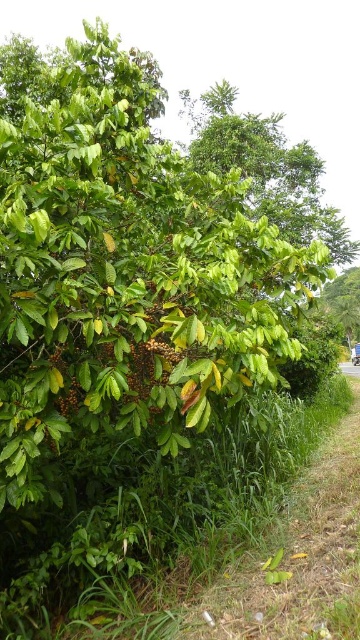
Which is more to the right, green leafy tree at upper center or green leafy tree at upper right?

From the viewer's perspective, green leafy tree at upper right appears more on the right side.

Is green leafy tree at upper center above green leafy tree at upper right?

Yes.

Who is more distant from viewer, (221, 131) or (333, 316)?

Positioned behind is point (333, 316).

Image resolution: width=360 pixels, height=640 pixels. In order to click on green leafy tree at upper center in this screenshot , I will do `click(266, 168)`.

What do you see at coordinates (266, 168) in the screenshot? The width and height of the screenshot is (360, 640). I see `green leafy tree at upper center` at bounding box center [266, 168].

Locate an element on the screen. green leafy tree at upper center is located at coordinates (266, 168).

Find the location of a particular element. green leafy tree at upper center is located at coordinates (266, 168).

The width and height of the screenshot is (360, 640). Find the location of `green leafy tree at upper center`. green leafy tree at upper center is located at coordinates (266, 168).

Between green leafy tree at upper right and gravel path at lower right, which one appears on the right side from the viewer's perspective?

green leafy tree at upper right

Is green leafy tree at upper right wider than gravel path at lower right?

Correct, the width of green leafy tree at upper right exceeds that of gravel path at lower right.

Who is more forward, (344, 332) or (349, 362)?

Positioned in front is point (349, 362).

The width and height of the screenshot is (360, 640). I want to click on green leafy tree at upper right, so click(x=344, y=301).